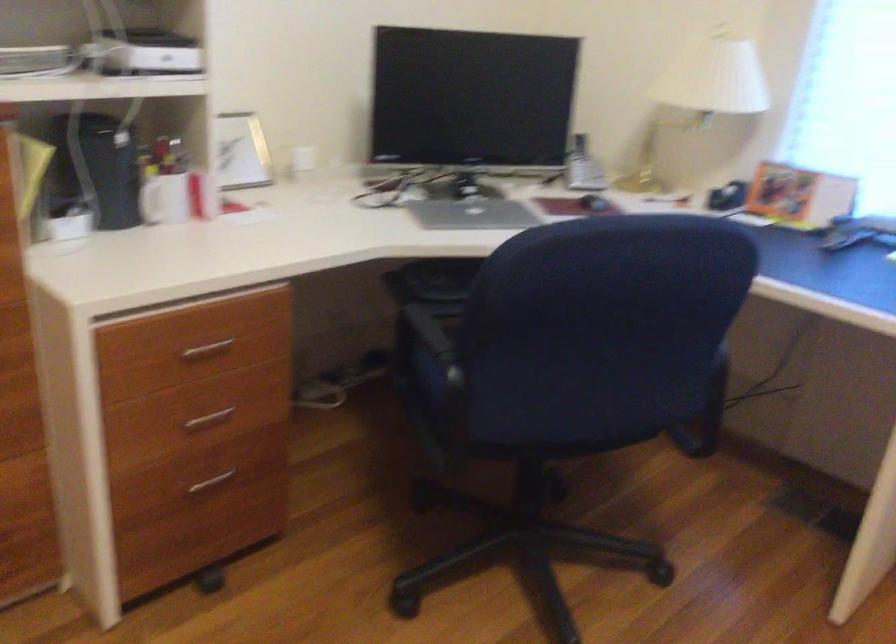
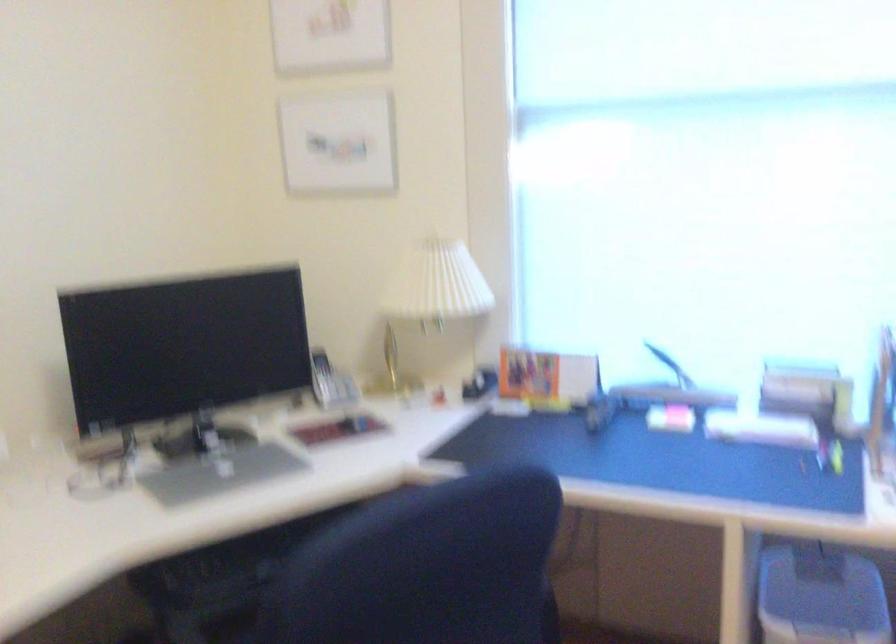
Locate, in the second image, the point that corresponds to (700,90) in the first image.

(433, 295)